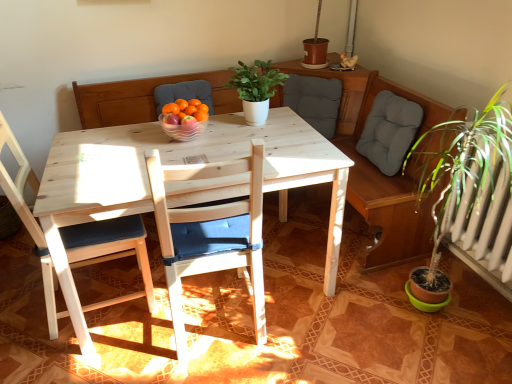
Question: From the image's perspective, relative to gray fabric cushion at upper center, is wooden chair with blue cushion at center, the second chair from the left, above or below?

Choices:
 (A) below
 (B) above

Answer: (A)

Question: Is wooden chair with blue cushion at center, the second chair from the left, taller or shorter than gray fabric cushion at upper center?

Choices:
 (A) short
 (B) tall

Answer: (B)

Question: Which is nearer to the wooden chair with blue cushion at center, which is the 1th chair from right to left?

Choices:
 (A) green matte plant at center
 (B) clear glass bowl at center
 (C) gray fabric cushion at upper center
 (D) wooden chair with blue cushion at left, which is counted as the 2th chair, starting from the right

Answer: (D)

Question: Estimate the real-world distances between objects in this image. Which object is farther from the gray fabric cushion at upper center?

Choices:
 (A) wooden chair with blue cushion at left, which is the 1th chair from left to right
 (B) wooden chair with blue cushion at center, the second chair from the left
 (C) green matte plant at center
 (D) clear glass bowl at center

Answer: (A)